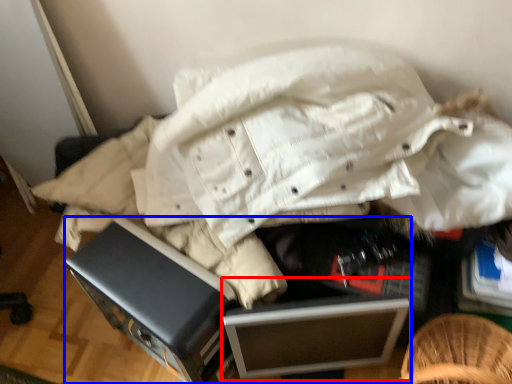
Question: Which of the following is the farthest to the observer, file cabinet (highlighted by a red box) or furniture (highlighted by a blue box)?

Choices:
 (A) file cabinet
 (B) furniture

Answer: (A)